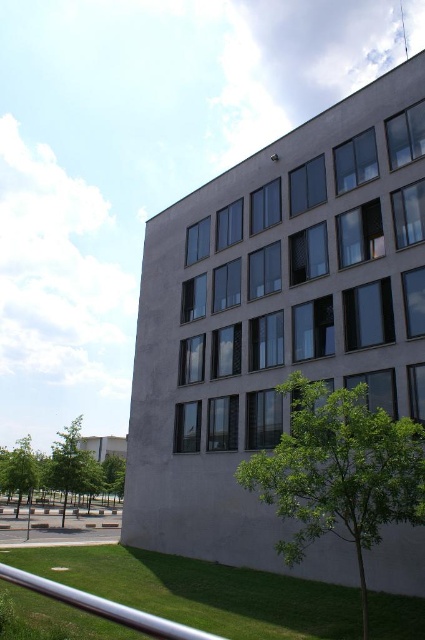
Question: Which point is farther from the camera taking this photo?

Choices:
 (A) (62, 522)
 (B) (393, 420)

Answer: (A)

Question: Among these points, which one is farthest from the camera?

Choices:
 (A) (404, 420)
 (B) (107, 454)
 (C) (266, 611)

Answer: (B)

Question: Does green grass at lower left lie in front of green leafy tree at lower left?

Choices:
 (A) no
 (B) yes

Answer: (B)

Question: Is green grass at lower left bigger than green leafy tree at center?

Choices:
 (A) yes
 (B) no

Answer: (A)

Question: Which point is closer to the camera taking this photo?

Choices:
 (A) (149, 566)
 (B) (319, 410)
 (C) (107, 442)

Answer: (B)

Question: Can you confirm if green grass at lower left is smaller than green leafy tree at center?

Choices:
 (A) no
 (B) yes

Answer: (A)